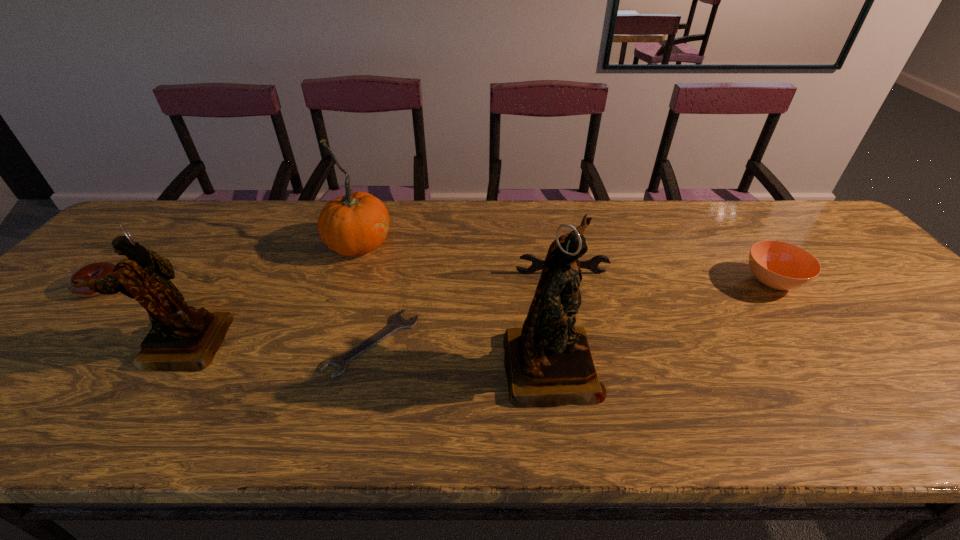
Where is `object that can be found as the third closest to the third shortest object`? The height and width of the screenshot is (540, 960). object that can be found as the third closest to the third shortest object is located at coordinates (779, 265).

Where is `object that is the sixth closest to the soup bowl`? The image size is (960, 540). object that is the sixth closest to the soup bowl is located at coordinates (100, 269).

At what (x,y) coordinates should I click in order to perform the action: click on vacant point that satisfies the following two spatial constraints: 1. on the front side of the pumpkin; 2. on the front-facing side of the second object from left to right. Please return your answer as a coordinate pair (x, y). The image size is (960, 540). Looking at the image, I should click on (324, 345).

Find the location of `vacant space that satisfies the following two spatial constraints: 1. on the open ends of the taller wrench; 2. on the front-facing side of the taller figurine`. vacant space that satisfies the following two spatial constraints: 1. on the open ends of the taller wrench; 2. on the front-facing side of the taller figurine is located at coordinates (581, 363).

Locate an element on the screen. This screenshot has width=960, height=540. free location that satisfies the following two spatial constraints: 1. on the front side of the fourth shortest object; 2. on the front-facing side of the taller figurine is located at coordinates (833, 363).

Locate an element on the screen. The width and height of the screenshot is (960, 540). free space in the image that satisfies the following two spatial constraints: 1. on the open ends of the soup bowl; 2. on the right side of the third shortest object is located at coordinates (564, 281).